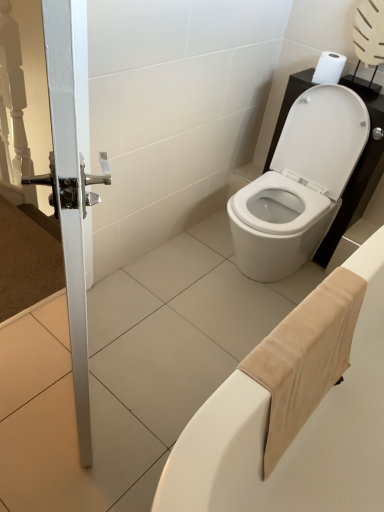
Question: Is the depth of white glossy door handle at left greater than that of white glossy toilet at center?

Choices:
 (A) yes
 (B) no

Answer: (B)

Question: Can you confirm if white glossy door handle at left is taller than white glossy toilet at center?

Choices:
 (A) no
 (B) yes

Answer: (B)

Question: From the image's perspective, is white glossy door handle at left on top of white glossy toilet at center?

Choices:
 (A) yes
 (B) no

Answer: (B)

Question: Is white glossy door handle at left facing away from white glossy toilet at center?

Choices:
 (A) no
 (B) yes

Answer: (B)

Question: From a real-world perspective, is white glossy door handle at left positioned over white glossy toilet at center based on gravity?

Choices:
 (A) yes
 (B) no

Answer: (A)

Question: From a real-world perspective, is beige fabric towel at lower right physically located above or below white matte toilet paper at upper right?

Choices:
 (A) above
 (B) below

Answer: (B)

Question: From their relative heights in the image, would you say beige fabric towel at lower right is taller or shorter than white matte toilet paper at upper right?

Choices:
 (A) short
 (B) tall

Answer: (B)

Question: Is beige fabric towel at lower right wider or thinner than white matte toilet paper at upper right?

Choices:
 (A) wide
 (B) thin

Answer: (A)

Question: Do you think beige fabric towel at lower right is within white matte toilet paper at upper right, or outside of it?

Choices:
 (A) inside
 (B) outside

Answer: (B)

Question: From a real-world perspective, relative to white glossy door handle at left, is beige fabric towel at lower right vertically above or below?

Choices:
 (A) below
 (B) above

Answer: (A)

Question: In terms of width, does beige fabric towel at lower right look wider or thinner when compared to white glossy door handle at left?

Choices:
 (A) wide
 (B) thin

Answer: (A)

Question: Based on their positions, is beige fabric towel at lower right located to the left or right of white glossy door handle at left?

Choices:
 (A) right
 (B) left

Answer: (A)

Question: Is point (334, 424) closer or farther from the camera than point (66, 17)?

Choices:
 (A) farther
 (B) closer

Answer: (A)

Question: Do you think white glossy toilet at center is within beige fabric towel at lower right, or outside of it?

Choices:
 (A) inside
 (B) outside

Answer: (B)

Question: Is white glossy toilet at center wider or thinner than beige fabric towel at lower right?

Choices:
 (A) thin
 (B) wide

Answer: (B)